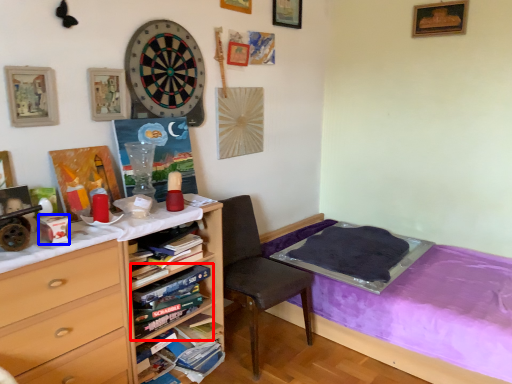
Question: Which point is closer to the camera, book (highlighted by a red box) or box (highlighted by a blue box)?

Choices:
 (A) book
 (B) box

Answer: (B)